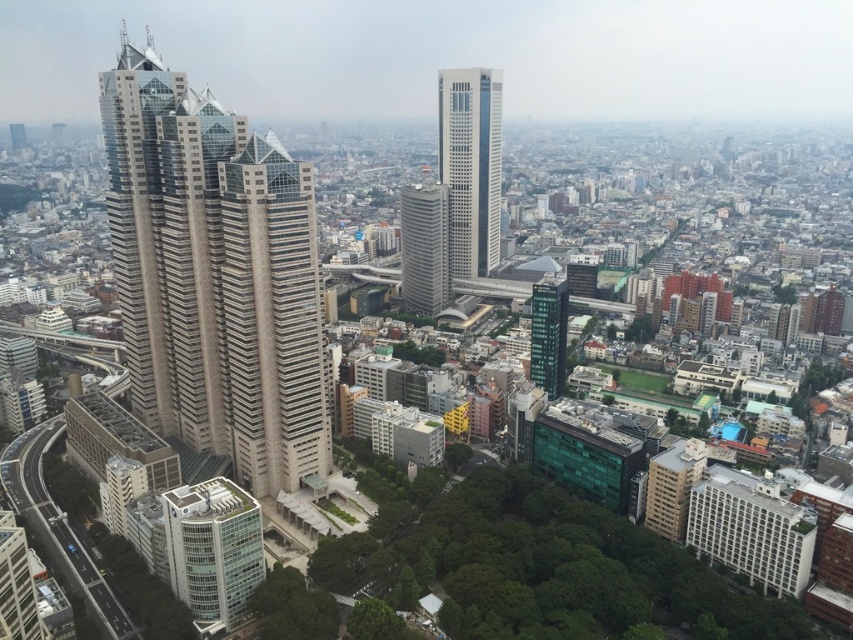
In the scene shown: Between beige glass skyscraper at center and white glass skyscraper at center, which one is positioned lower?

white glass skyscraper at center is below.

Image resolution: width=853 pixels, height=640 pixels. Describe the element at coordinates (213, 275) in the screenshot. I see `beige glass skyscraper at center` at that location.

Find the location of a particular element. beige glass skyscraper at center is located at coordinates (213, 275).

Does white glossy building at center appear over green glass building at center?

Yes, white glossy building at center is above green glass building at center.

What do you see at coordinates (424, 248) in the screenshot?
I see `white glossy building at center` at bounding box center [424, 248].

Identify the location of white glossy building at center. Image resolution: width=853 pixels, height=640 pixels. (424, 248).

Which is more to the right, beige glass skyscraper at center or white glossy building at center?

white glossy building at center is more to the right.

Find the location of `beige glass skyscraper at center`. beige glass skyscraper at center is located at coordinates (213, 275).

Find the location of `beige glass skyscraper at center`. beige glass skyscraper at center is located at coordinates (213, 275).